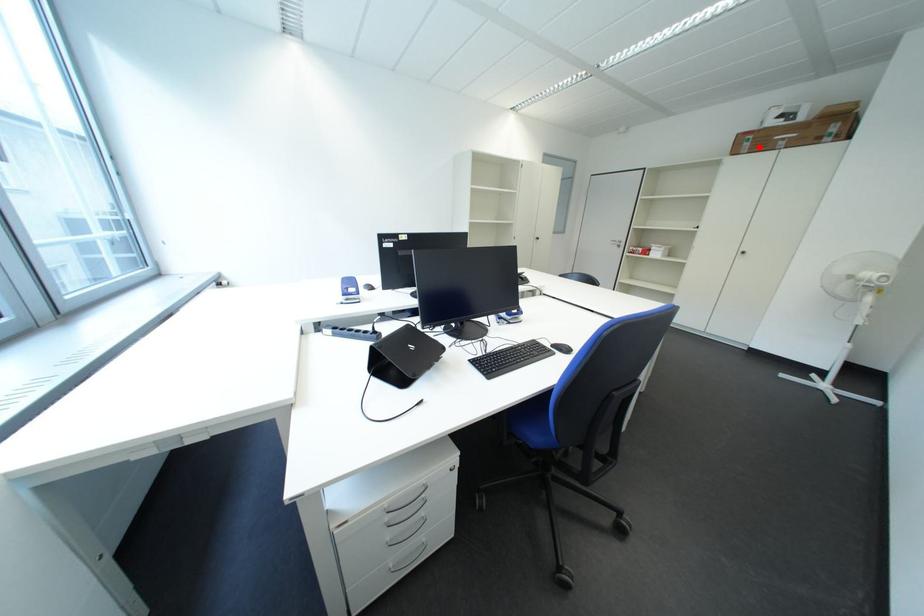
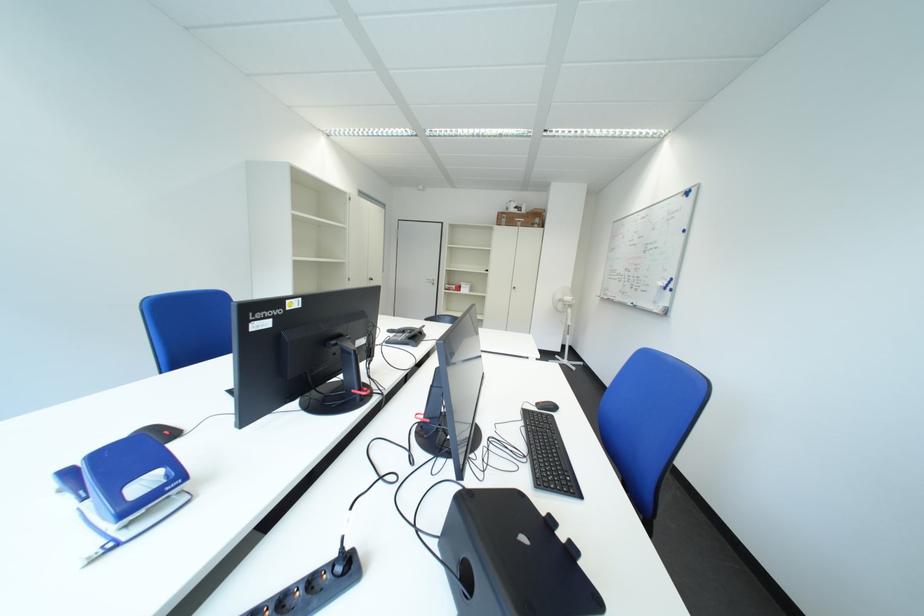
The point at the highlighted location is marked in the first image. Where is the corresponding point in the second image?

(517, 223)